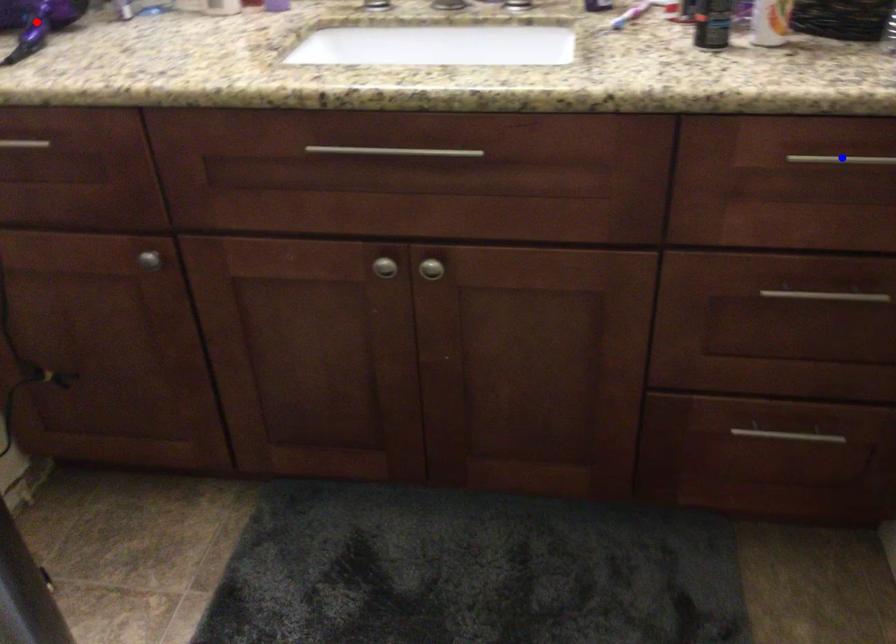
Question: Two points are marked on the image. Which point is closer to the camera?

Choices:
 (A) Blue point is closer.
 (B) Red point is closer.

Answer: (A)